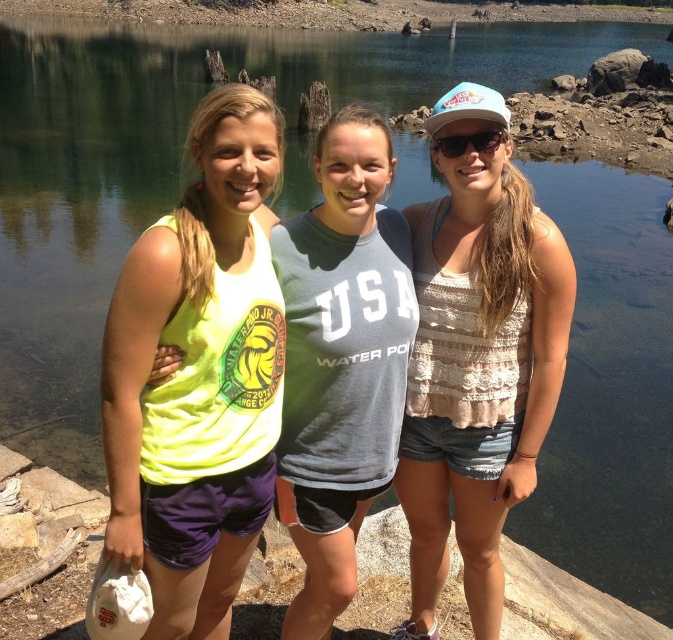
Does neon yellow tank top at center have a greater height compared to white textured tank top at center?

No, neon yellow tank top at center is not taller than white textured tank top at center.

How far apart are neon yellow tank top at center and white textured tank top at center?

They are 6.34 meters apart.

What do you see at coordinates (199, 374) in the screenshot? I see `neon yellow tank top at center` at bounding box center [199, 374].

I want to click on neon yellow tank top at center, so click(x=199, y=374).